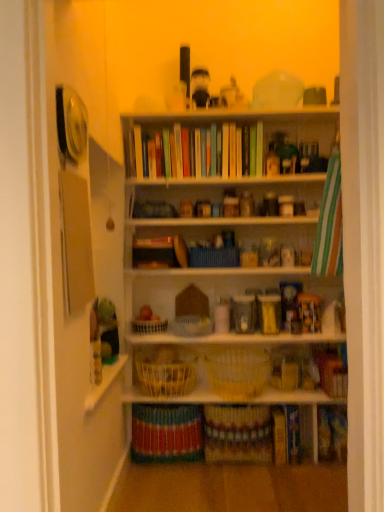
Image resolution: width=384 pixels, height=512 pixels. What do you see at coordinates (331, 371) in the screenshot? I see `matte brown book at lower right, which is the first book from right to left` at bounding box center [331, 371].

What do you see at coordinates (149, 326) in the screenshot?
I see `white woven basket at center, which ranks as the 3th basket in bottom-to-top order` at bounding box center [149, 326].

The image size is (384, 512). I want to click on white woven basket at center, which appears as the fourth basket when viewed from the top, so click(237, 373).

What do you see at coordinates (166, 433) in the screenshot? I see `multicolored woven basket at lower center, the first book when ordered from left to right` at bounding box center [166, 433].

In order to face multicolored woven basket at lower center, acting as the third book starting from the right, should I rotate leftwards or rightwards?

Turn left by 2.961 degrees to look at multicolored woven basket at lower center, acting as the third book starting from the right.

The width and height of the screenshot is (384, 512). What do you see at coordinates (166, 372) in the screenshot?
I see `woven yellow basket at center, the 5th basket when ordered from top to bottom` at bounding box center [166, 372].

Locate an element on the screen. This screenshot has height=512, width=384. matte brown book at lower right, placed as the 3th book when sorted from left to right is located at coordinates (331, 371).

Is matte brown book at lower right, placed as the 3th book when sorted from left to right, taller than hardcover book at lower right, placed as the second book when sorted from left to right?

No.

Is matte brown book at lower right, which is the first book from right to left, to the right of hardcover book at lower right, which is the 2th book in right-to-left order, from the viewer's perspective?

Correct, you'll find matte brown book at lower right, which is the first book from right to left, to the right of hardcover book at lower right, which is the 2th book in right-to-left order.

Does matte brown book at lower right, placed as the 3th book when sorted from left to right, come behind hardcover book at lower right, placed as the second book when sorted from left to right?

That is False.

Based on the photo, from the image's perspective, is matte brown book at lower right, placed as the 3th book when sorted from left to right, above or below hardcover book at lower right, which is the 2th book in right-to-left order?

Based on their image positions, matte brown book at lower right, placed as the 3th book when sorted from left to right, is located above hardcover book at lower right, which is the 2th book in right-to-left order.

Is white matte bookcase at center positioned behind multicolored woven basket at lower center, acting as the third book starting from the right?

No, it is in front of multicolored woven basket at lower center, acting as the third book starting from the right.

Is white matte bookcase at center far from multicolored woven basket at lower center, the first book when ordered from left to right?

They are positioned close to each other.

Is white matte bookcase at center turned away from multicolored woven basket at lower center, the first book when ordered from left to right?

No, white matte bookcase at center is not facing the opposite direction of multicolored woven basket at lower center, the first book when ordered from left to right.

Is woven brown basket at center, marked as the 5th basket in a bottom-to-top arrangement, touching white woven basket at center, which is the third basket from top to bottom?

woven brown basket at center, marked as the 5th basket in a bottom-to-top arrangement, and white woven basket at center, which is the third basket from top to bottom, are not in contact.

Is woven brown basket at center, which appears as the first basket when viewed from the top, oriented towards white woven basket at center, which is the third basket from top to bottom?

No, woven brown basket at center, which appears as the first basket when viewed from the top, is not oriented towards white woven basket at center, which is the third basket from top to bottom.

Can you confirm if matte brown book at lower right, which is the first book from right to left, is positioned to the right of white woven basket at center, which is the fourth basket in bottom-to-top order?

Yes, matte brown book at lower right, which is the first book from right to left, is to the right of white woven basket at center, which is the fourth basket in bottom-to-top order.

Is matte brown book at lower right, placed as the 3th book when sorted from left to right, not near white woven basket at center, which is the fourth basket in bottom-to-top order?

No, there isn't a large distance between matte brown book at lower right, placed as the 3th book when sorted from left to right, and white woven basket at center, which is the fourth basket in bottom-to-top order.

Considering the sizes of objects matte brown book at lower right, placed as the 3th book when sorted from left to right, and white woven basket at center, the 2th basket when ordered from top to bottom, in the image provided, who is bigger, matte brown book at lower right, placed as the 3th book when sorted from left to right, or white woven basket at center, the 2th basket when ordered from top to bottom,?

matte brown book at lower right, placed as the 3th book when sorted from left to right, is bigger.

Between hardcover book at lower right, which is the 2th book in right-to-left order, and multicolored woven basket at lower center, the first book when ordered from left to right, which one has more height?

multicolored woven basket at lower center, the first book when ordered from left to right.

Which is in front, hardcover book at lower right, placed as the second book when sorted from left to right, or multicolored woven basket at lower center, the first book when ordered from left to right?

multicolored woven basket at lower center, the first book when ordered from left to right, is in front.

Based on the photo, from a real-world perspective, which object rests below the other?

hardcover book at lower right, placed as the second book when sorted from left to right.

Does point (173, 415) come in front of point (277, 429)?

No, (173, 415) is behind (277, 429).

Considering the relative sizes of multicolored woven basket at lower center, acting as the third book starting from the right, and hardcover book at lower right, which is the 2th book in right-to-left order, in the image provided, is multicolored woven basket at lower center, acting as the third book starting from the right, smaller than hardcover book at lower right, which is the 2th book in right-to-left order,?

Actually, multicolored woven basket at lower center, acting as the third book starting from the right, might be larger than hardcover book at lower right, which is the 2th book in right-to-left order.

Is hardcover book at lower right, placed as the second book when sorted from left to right, at the back of multicolored woven basket at lower center, the first book when ordered from left to right?

No, hardcover book at lower right, placed as the second book when sorted from left to right, is not at the back of multicolored woven basket at lower center, the first book when ordered from left to right.

Where is `book below the multicolored woven basket at lower center, acting as the third book starting from the right (from the image's perspective)`? This screenshot has height=512, width=384. book below the multicolored woven basket at lower center, acting as the third book starting from the right (from the image's perspective) is located at coordinates (286, 434).

In the scene shown: Is white matte bookcase at center aimed at white woven basket at center, the 2th basket when ordered from top to bottom?

Yes, white matte bookcase at center faces towards white woven basket at center, the 2th basket when ordered from top to bottom.

From the image's perspective, is white matte bookcase at center positioned above or below white woven basket at center, the 2th basket when ordered from top to bottom?

From the image's perspective, white matte bookcase at center appears above white woven basket at center, the 2th basket when ordered from top to bottom.

Can you tell me how much white matte bookcase at center and white woven basket at center, which is the fourth basket in bottom-to-top order, differ in facing direction?

The angle between the facing direction of white matte bookcase at center and the facing direction of white woven basket at center, which is the fourth basket in bottom-to-top order, is 179 degrees.

At what (x,y) coordinates should I click in order to perform the action: click on the 2nd book directly above the hardcover book at lower right, which is the 2th book in right-to-left order (from a real-world perspective). Please return your answer as a coordinate pair (x, y). Looking at the image, I should click on (331, 371).

At what (x,y) coordinates should I click in order to perform the action: click on bookcase in front of the multicolored woven basket at lower center, the first book when ordered from left to right. Please return your answer as a coordinate pair (x, y). The image size is (384, 512). Looking at the image, I should click on (236, 245).

Based on the photo, estimate the real-world distances between objects in this image. Which object is further from white matte bookcase at center, hardcover book at lower right, which is the 2th book in right-to-left order, or matte brown book at lower right, which is the first book from right to left?

Among the two, hardcover book at lower right, which is the 2th book in right-to-left order, is located further to white matte bookcase at center.

Based on their spatial positions, is multicolored woven basket at lower center, acting as the third book starting from the right, or white matte bookcase at center closer to white woven basket at center, which ranks as the 3th basket in bottom-to-top order?

Among the two, multicolored woven basket at lower center, acting as the third book starting from the right, is located nearer to white woven basket at center, which ranks as the 3th basket in bottom-to-top order.

Consider the image. Considering their positions, is hardcover book at lower right, placed as the second book when sorted from left to right, positioned closer to green plush toy at lower left than white matte bookcase at center?

The object closer to green plush toy at lower left is white matte bookcase at center.

When comparing their distances from matte brown book at lower right, which is the first book from right to left, does woven yellow basket at center, the 1th basket from the bottom, or woven brown basket at center, marked as the 5th basket in a bottom-to-top arrangement, seem further?

woven yellow basket at center, the 1th basket from the bottom, is positioned further to the anchor matte brown book at lower right, which is the first book from right to left.

Considering their positions, is woven yellow basket at center, the 1th basket from the bottom, positioned closer to green plush toy at lower left than woven brown basket at center, marked as the 5th basket in a bottom-to-top arrangement?

woven yellow basket at center, the 1th basket from the bottom, is closer to green plush toy at lower left.

Which object lies nearer to the anchor point white woven basket at center, the second basket positioned from the bottom, white woven basket at center, the 2th basket when ordered from top to bottom, or multicolored woven basket at lower center, the first book when ordered from left to right?

white woven basket at center, the 2th basket when ordered from top to bottom.

Considering their positions, is woven yellow basket at center, the 1th basket from the bottom, positioned further to white woven basket at center, the 2th basket when ordered from top to bottom, than matte brown book at lower right, placed as the 3th book when sorted from left to right?

matte brown book at lower right, placed as the 3th book when sorted from left to right, lies further to white woven basket at center, the 2th basket when ordered from top to bottom, than the other object.

Considering their positions, is woven brown basket at center, marked as the 5th basket in a bottom-to-top arrangement, positioned closer to hardcover book at lower right, placed as the second book when sorted from left to right, than green plush toy at lower left?

The object closer to hardcover book at lower right, placed as the second book when sorted from left to right, is woven brown basket at center, marked as the 5th basket in a bottom-to-top arrangement.

Where is `toy between white matte bookcase at center and multicolored woven basket at lower center, acting as the third book starting from the right, along the z-axis`? This screenshot has height=512, width=384. toy between white matte bookcase at center and multicolored woven basket at lower center, acting as the third book starting from the right, along the z-axis is located at coordinates click(x=105, y=328).

What are the coordinates of `book between white matte bookcase at center and multicolored woven basket at lower center, the first book when ordered from left to right, along the z-axis` in the screenshot? It's located at (331, 371).

Identify the location of book located between green plush toy at lower left and white woven basket at center, which appears as the fourth basket when viewed from the top, in the left-right direction. (166, 433).

This screenshot has width=384, height=512. In order to click on book between green plush toy at lower left and hardcover book at lower right, which is the 2th book in right-to-left order in this screenshot , I will do `click(166, 433)`.